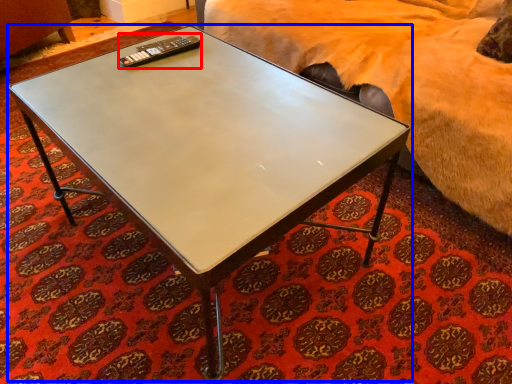
Question: Among these objects, which one is nearest to the camera, remote (highlighted by a red box) or coffee table (highlighted by a blue box)?

Choices:
 (A) remote
 (B) coffee table

Answer: (B)